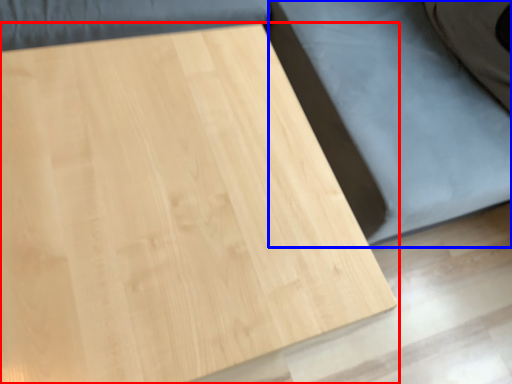
Question: Which object is further to the camera taking this photo, table (highlighted by a red box) or bed frame (highlighted by a blue box)?

Choices:
 (A) table
 (B) bed frame

Answer: (B)